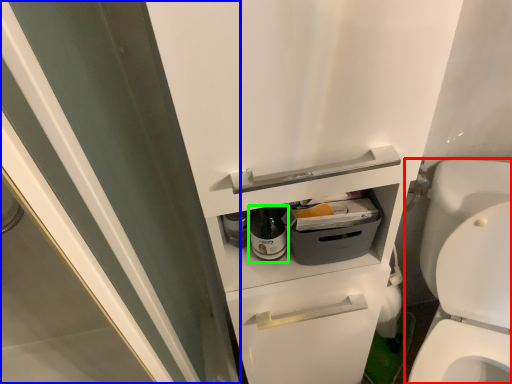
Question: Which object is the farthest from toilet (highlighted by a red box)? Choose among these: screen door (highlighted by a blue box) or bottle (highlighted by a green box).

Choices:
 (A) screen door
 (B) bottle

Answer: (A)